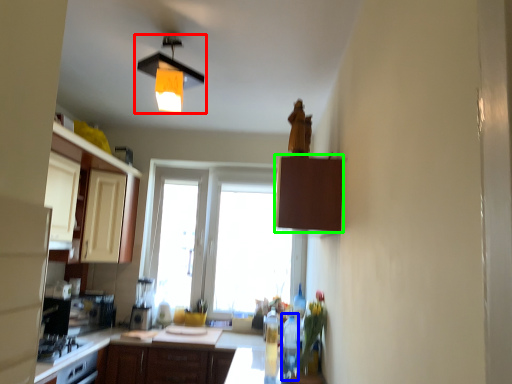
Question: Based on their relative distances, which object is farther from lamp (highlighted by a red box)? Choose from bottle (highlighted by a blue box) and cabinetry (highlighted by a green box).

Choices:
 (A) bottle
 (B) cabinetry

Answer: (A)